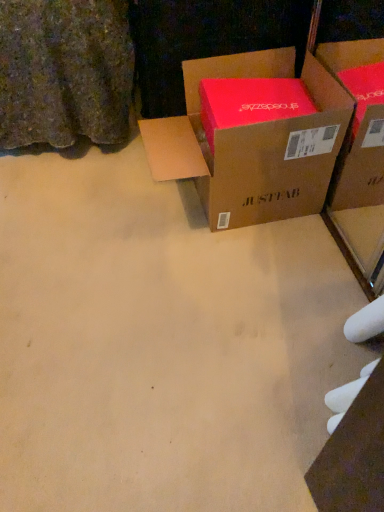
You are a GUI agent. You are given a task and a screenshot of the screen. Output one action in this format:
    pyautogui.click(x=<x>, y=<y>)
    Task: Click on the free spot to the left of matte cardboard box at center
    The height and width of the screenshot is (512, 384).
    Given the screenshot: What is the action you would take?
    pyautogui.click(x=92, y=219)